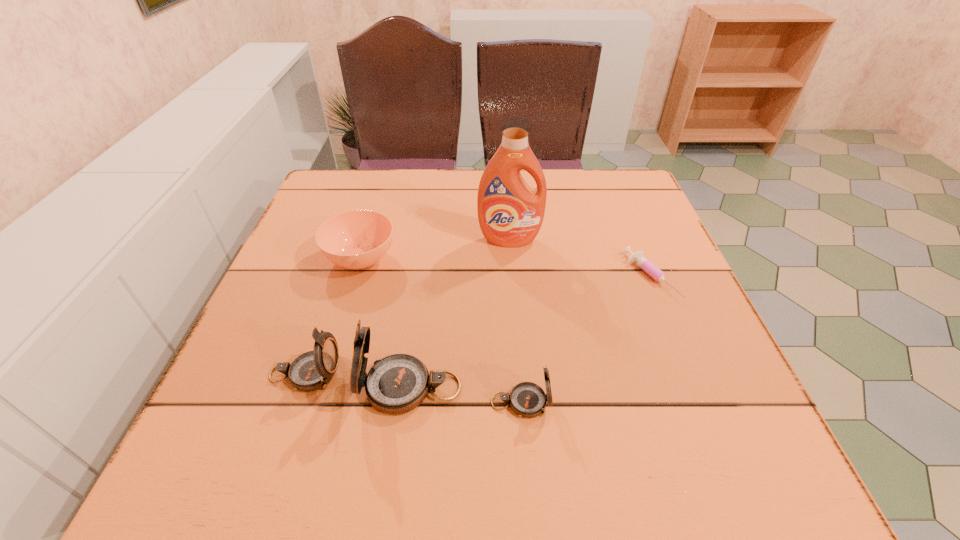
Locate an element on the screen. free spot between the syringe and the fifth shortest object is located at coordinates coord(531,332).

Find the location of `blank region between the second tallest object and the detergent`. blank region between the second tallest object and the detergent is located at coordinates (460, 314).

Where is `free spot between the detergent and the second compass from left to right`? free spot between the detergent and the second compass from left to right is located at coordinates (460, 314).

Find the location of a particular element. This screenshot has width=960, height=540. empty space between the fifth shortest object and the detergent is located at coordinates (460, 314).

Locate an element on the screen. vacant area that lies between the syringe and the second compass from right to left is located at coordinates (531, 332).

What are the coordinates of `unoccupied area between the second shortest object and the shortest compass` in the screenshot? It's located at (441, 331).

You are a GUI agent. You are given a task and a screenshot of the screen. Output one action in this format:
    pyautogui.click(x=<x>, y=<y>)
    Task: Click on the object that is the fourth closest to the syringe
    The width and height of the screenshot is (960, 540).
    Given the screenshot: What is the action you would take?
    pyautogui.click(x=358, y=239)

Select which object appears as the fourth closest to the second tallest object. Please provide its 2D coordinates. Your answer should be formatted as a tuple, i.e. [(x, y)], where the tuple contains the x and y coordinates of a point satisfying the conditions above.

[(510, 213)]

Choose which compass is the nearest neighbor to the leftmost compass. Please provide its 2D coordinates. Your answer should be formatted as a tuple, i.e. [(x, y)], where the tuple contains the x and y coordinates of a point satisfying the conditions above.

[(398, 383)]

Locate an element on the screen. The width and height of the screenshot is (960, 540). compass that can be found as the closest to the second shortest compass is located at coordinates (398, 383).